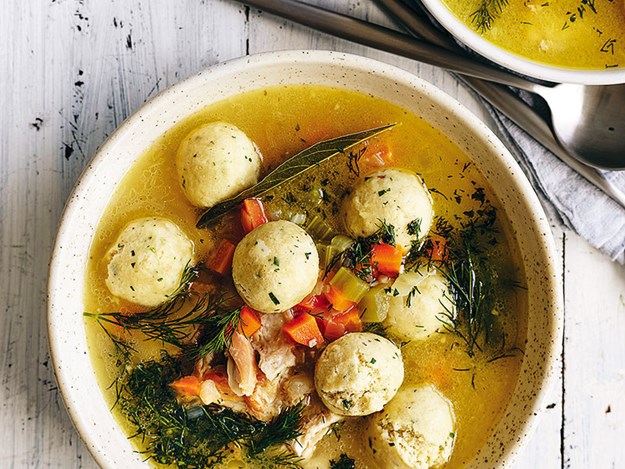
At what (x,y) coordinates should I click in order to perform the action: click on bowl. Please return your answer as a coordinate pair (x, y). This screenshot has height=469, width=625. Looking at the image, I should click on (540, 362), (101, 419), (97, 183), (562, 67), (434, 1).